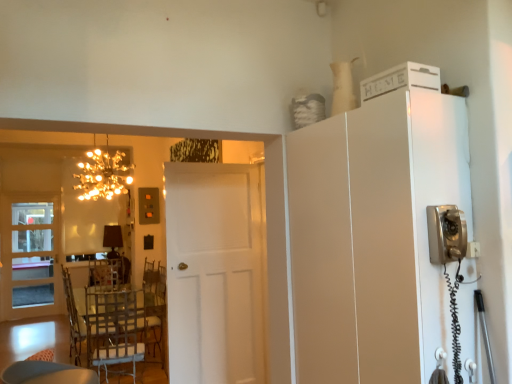
Find the location of a particular element. The height and width of the screenshot is (384, 512). gold metallic chandelier at upper left is located at coordinates (103, 174).

This screenshot has width=512, height=384. What do you see at coordinates (104, 327) in the screenshot? I see `metallic silver chair at lower left` at bounding box center [104, 327].

Identify the location of white matte cabinet at upper right, which is the 1th appliance in back-to-front order. The height and width of the screenshot is (384, 512). (400, 80).

Describe the element at coordinates (374, 237) in the screenshot. I see `white matte cabinet at upper right` at that location.

Image resolution: width=512 pixels, height=384 pixels. I want to click on gold metallic chandelier at upper left, so click(103, 174).

Is gold metallic chandelier at upper left at the back of white matte cabinet at upper right, the second appliance when ordered from bottom to top?

Yes, white matte cabinet at upper right, the second appliance when ordered from bottom to top, is positioned with its back facing gold metallic chandelier at upper left.

Between white matte cabinet at upper right, which is the 1th appliance in back-to-front order, and gold metallic chandelier at upper left, which one is positioned in front?

white matte cabinet at upper right, which is the 1th appliance in back-to-front order, is in front.

How many degrees apart are the facing directions of white matte cabinet at upper right, placed as the first appliance when sorted from top to bottom, and gold metallic chandelier at upper left?

89.4 degrees.

Measure the distance between white matte cabinet at upper right, which is the 1th appliance in back-to-front order, and gold metallic chandelier at upper left.

They are 10.85 feet apart.

Which of these two, metallic silver chair at lower left or satin silver telephone at right, which is the first appliance from bottom to top, is bigger?

With larger size is metallic silver chair at lower left.

Is metallic silver chair at lower left oriented towards satin silver telephone at right, which is the first appliance from bottom to top?

No, metallic silver chair at lower left is not oriented towards satin silver telephone at right, which is the first appliance from bottom to top.

How many degrees apart are the facing directions of metallic silver chair at lower left and satin silver telephone at right, which is counted as the 1th appliance, starting from the front?

88.4 degrees separate the facing orientations of metallic silver chair at lower left and satin silver telephone at right, which is counted as the 1th appliance, starting from the front.

In the image, is metallic silver chair at lower left on the left side or the right side of satin silver telephone at right, which is the second appliance from back to front?

In the image, metallic silver chair at lower left appears on the left side of satin silver telephone at right, which is the second appliance from back to front.

From the image's perspective, is white matte cabinet at upper right beneath satin silver telephone at right, which is the second appliance from back to front?

Yes, from the image's perspective, white matte cabinet at upper right is beneath satin silver telephone at right, which is the second appliance from back to front.

Considering the positions of objects white matte cabinet at upper right and satin silver telephone at right, which is the first appliance from bottom to top, in the image provided, who is behind, white matte cabinet at upper right or satin silver telephone at right, which is the first appliance from bottom to top,?

white matte cabinet at upper right is further away from the camera.

Between white matte cabinet at upper right and satin silver telephone at right, which appears as the 2th appliance when viewed from the top, which one has smaller width?

satin silver telephone at right, which appears as the 2th appliance when viewed from the top, is thinner.

Is white matte cabinet at upper right bigger than satin silver telephone at right, which is the second appliance from back to front?

Correct, white matte cabinet at upper right is larger in size than satin silver telephone at right, which is the second appliance from back to front.

How distant is satin silver telephone at right, which is the second appliance from back to front, from white matte cabinet at upper right?

A: 13.52 inches.

From the image's perspective, which one is positioned lower, satin silver telephone at right, which is the first appliance from bottom to top, or white matte cabinet at upper right?

white matte cabinet at upper right, from the image's perspective.

In the image, is satin silver telephone at right, which is the first appliance from bottom to top, positioned in front of or behind white matte cabinet at upper right?

Clearly, satin silver telephone at right, which is the first appliance from bottom to top, is in front of white matte cabinet at upper right.

Which is farther, [437,249] or [90,320]?

The point [90,320] is behind.

Visually, is satin silver telephone at right, which is the first appliance from bottom to top, positioned to the left or to the right of metallic silver chair at lower left?

satin silver telephone at right, which is the first appliance from bottom to top, is positioned on metallic silver chair at lower left's right side.

Could you tell me if satin silver telephone at right, which is the first appliance from bottom to top, is facing metallic silver chair at lower left?

No, satin silver telephone at right, which is the first appliance from bottom to top, is not facing towards metallic silver chair at lower left.

From the image's perspective, which one is positioned lower, satin silver telephone at right, which is the first appliance from bottom to top, or metallic silver chair at lower left?

metallic silver chair at lower left.

What's the angular difference between translucent glass door at left, acting as the 2th door starting from the right, and white matte cabinet at upper right's facing directions?

The angle between the facing direction of translucent glass door at left, acting as the 2th door starting from the right, and the facing direction of white matte cabinet at upper right is 89.5 degrees.

Is translucent glass door at left, the 1th door from the back, closer to the viewer compared to white matte cabinet at upper right?

No, it is behind white matte cabinet at upper right.

Does translucent glass door at left, which appears as the first door when viewed from the left, appear on the left side of white matte cabinet at upper right?

Yes.

In the scene shown: From the image's perspective, is white matte door at center, which ranks as the first door in front-to-back order, located above or below translucent glass door at left, the 1th door from the back?

white matte door at center, which ranks as the first door in front-to-back order, is above translucent glass door at left, the 1th door from the back.

Which of these two, white matte door at center, positioned as the 2th door in left-to-right order, or translucent glass door at left, the 2th door in the front-to-back sequence, stands taller?

With more height is translucent glass door at left, the 2th door in the front-to-back sequence.

Who is smaller, white matte door at center, which ranks as the first door in front-to-back order, or translucent glass door at left, which appears as the first door when viewed from the left?

translucent glass door at left, which appears as the first door when viewed from the left.

From a real-world perspective, is white matte door at center, placed as the second door when sorted from back to front, located higher than translucent glass door at left, acting as the 2th door starting from the right?

Indeed, from a real-world perspective, white matte door at center, placed as the second door when sorted from back to front, stands above translucent glass door at left, acting as the 2th door starting from the right.

The height and width of the screenshot is (384, 512). I want to click on appliance that is above the gold metallic chandelier at upper left (from the image's perspective), so click(x=400, y=80).

Where is `chair below the satin silver telephone at right, which is the first appliance from bottom to top (from a real-world perspective)`? chair below the satin silver telephone at right, which is the first appliance from bottom to top (from a real-world perspective) is located at coordinates (104, 327).

When comparing their distances from satin silver telephone at right, which is the first appliance from bottom to top, does metallic silver chair at lower left or gold metallic chandelier at upper left seem closer?

metallic silver chair at lower left is positioned closer to the anchor satin silver telephone at right, which is the first appliance from bottom to top.

Based on their spatial positions, is satin silver telephone at right, which is the second appliance from back to front, or gold metallic chandelier at upper left further from white matte cabinet at upper right?

Based on the image, gold metallic chandelier at upper left appears to be further to white matte cabinet at upper right.

Which object lies nearer to the anchor point translucent glass door at left, acting as the 2th door starting from the right, white matte cabinet at upper right or gold metallic chandelier at upper left?

Among the two, gold metallic chandelier at upper left is located nearer to translucent glass door at left, acting as the 2th door starting from the right.

Based on the photo, estimate the real-world distances between objects in this image. Which object is further from translucent glass door at left, which appears as the first door when viewed from the left, white matte cabinet at upper right, which is the 1th appliance in back-to-front order, or white matte cabinet at upper right?

Based on the image, white matte cabinet at upper right, which is the 1th appliance in back-to-front order, appears to be further to translucent glass door at left, which appears as the first door when viewed from the left.

Considering their positions, is metallic silver chair at lower left positioned further to gold metallic chandelier at upper left than white matte cabinet at upper right, which is the 1th appliance in back-to-front order?

white matte cabinet at upper right, which is the 1th appliance in back-to-front order, is positioned further to the anchor gold metallic chandelier at upper left.

Estimate the real-world distances between objects in this image. Which object is further from white matte door at center, the 1th door when ordered from right to left, white matte cabinet at upper right, which is the 1th appliance in back-to-front order, or translucent glass door at left, the 1th door from the back?

translucent glass door at left, the 1th door from the back, is further to white matte door at center, the 1th door when ordered from right to left.

Which object lies nearer to the anchor point metallic silver chair at lower left, gold metallic chandelier at upper left or translucent glass door at left, the 2th door in the front-to-back sequence?

gold metallic chandelier at upper left is positioned closer to the anchor metallic silver chair at lower left.

Based on their spatial positions, is white matte cabinet at upper right or translucent glass door at left, which appears as the first door when viewed from the left, further from white matte door at center, placed as the second door when sorted from back to front?

The object further to white matte door at center, placed as the second door when sorted from back to front, is translucent glass door at left, which appears as the first door when viewed from the left.

This screenshot has width=512, height=384. What are the coordinates of `door positioned between white matte cabinet at upper right and gold metallic chandelier at upper left from near to far` in the screenshot? It's located at (215, 273).

Where is `cabinetry between metallic silver chair at lower left and satin silver telephone at right, which is the first appliance from bottom to top`? The height and width of the screenshot is (384, 512). cabinetry between metallic silver chair at lower left and satin silver telephone at right, which is the first appliance from bottom to top is located at coordinates (374, 237).

I want to click on appliance located between white matte cabinet at upper right and translucent glass door at left, acting as the 2th door starting from the right, in the depth direction, so click(x=400, y=80).

Locate an element on the screen. appliance between white matte cabinet at upper right and white matte door at center, which ranks as the first door in front-to-back order, along the z-axis is located at coordinates (400, 80).